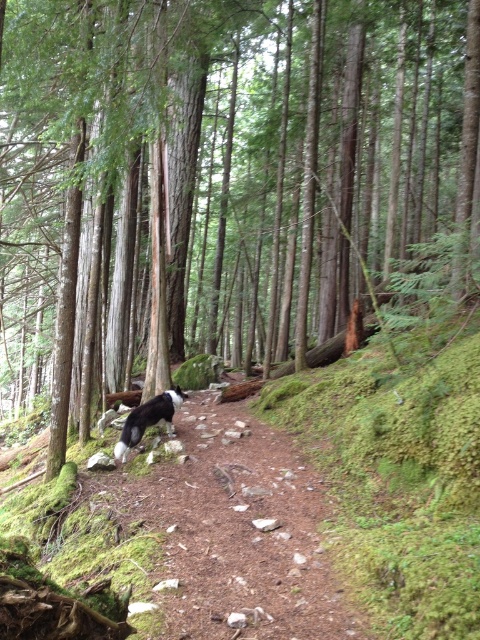
Question: Which point is closer to the camera?

Choices:
 (A) (119, 445)
 (B) (166, 502)

Answer: (B)

Question: Which point is farther from the camera taking this photo?

Choices:
 (A) (249, 612)
 (B) (144, 417)

Answer: (B)

Question: Is brown dirt trail at center further to camera compared to black and white fur at center?

Choices:
 (A) yes
 (B) no

Answer: (B)

Question: Considering the relative positions of brown dirt trail at center and black and white fur at center in the image provided, where is brown dirt trail at center located with respect to black and white fur at center?

Choices:
 (A) below
 (B) above

Answer: (A)

Question: Is brown dirt trail at center to the right of black and white fur at center from the viewer's perspective?

Choices:
 (A) no
 (B) yes

Answer: (B)